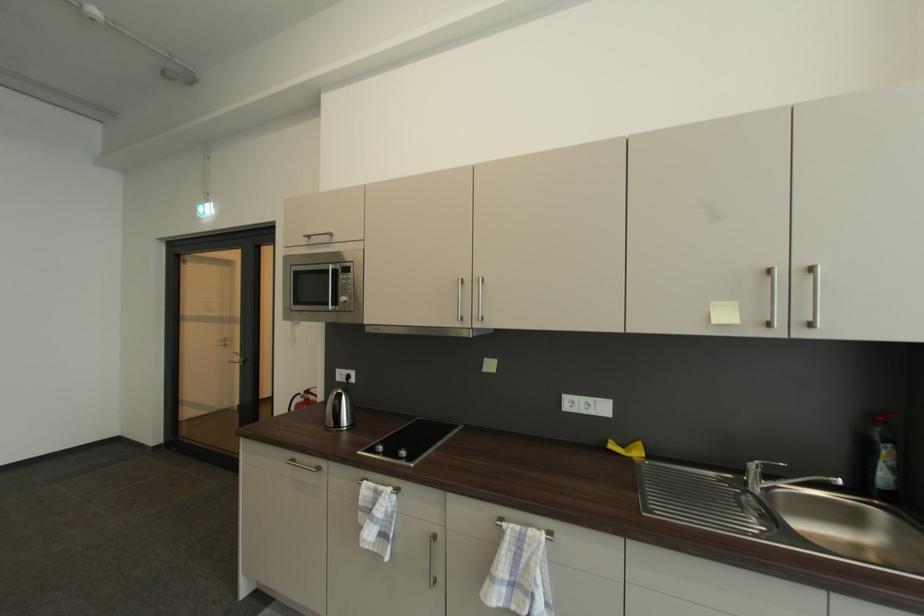
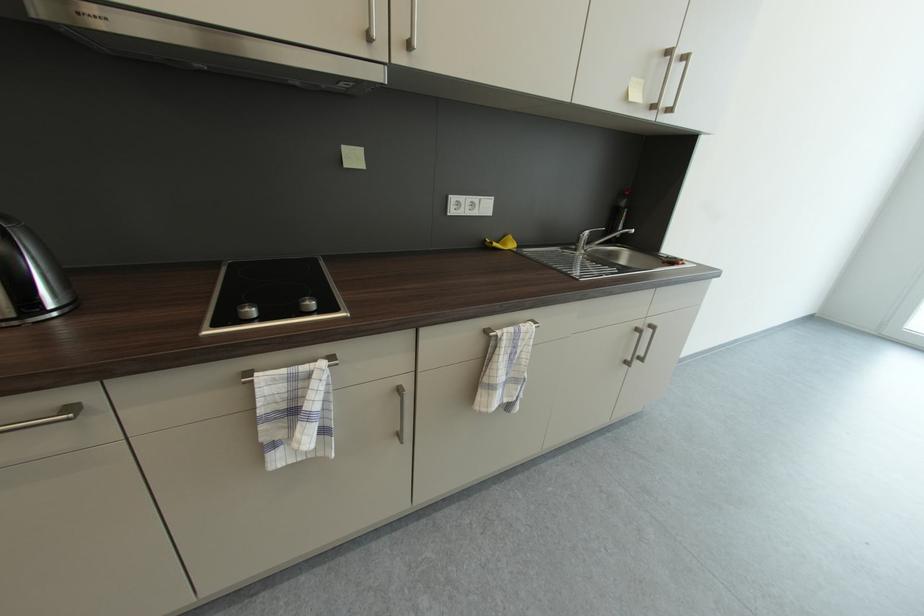
Based on the continuous images, in which direction is the camera rotating?

The camera rotated toward right-down.